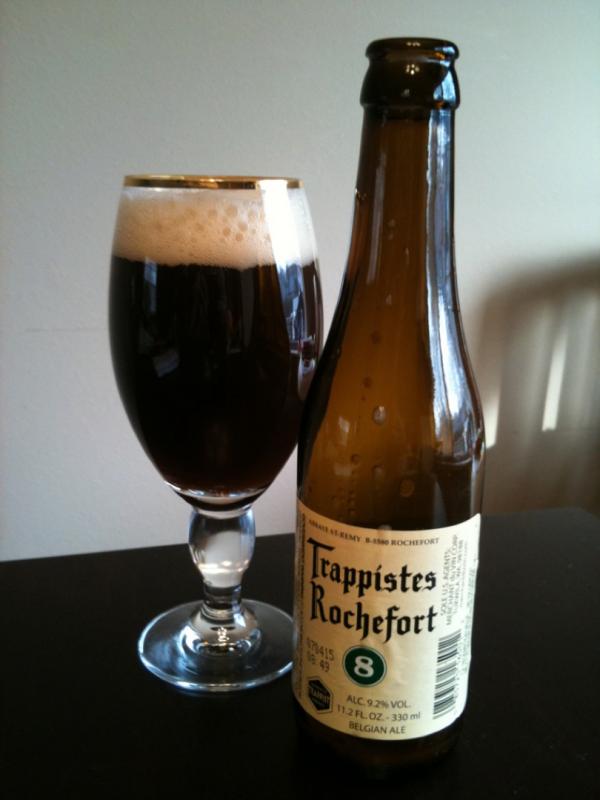
Locate an element on the screen. The height and width of the screenshot is (800, 600). glass stem is located at coordinates (227, 566).